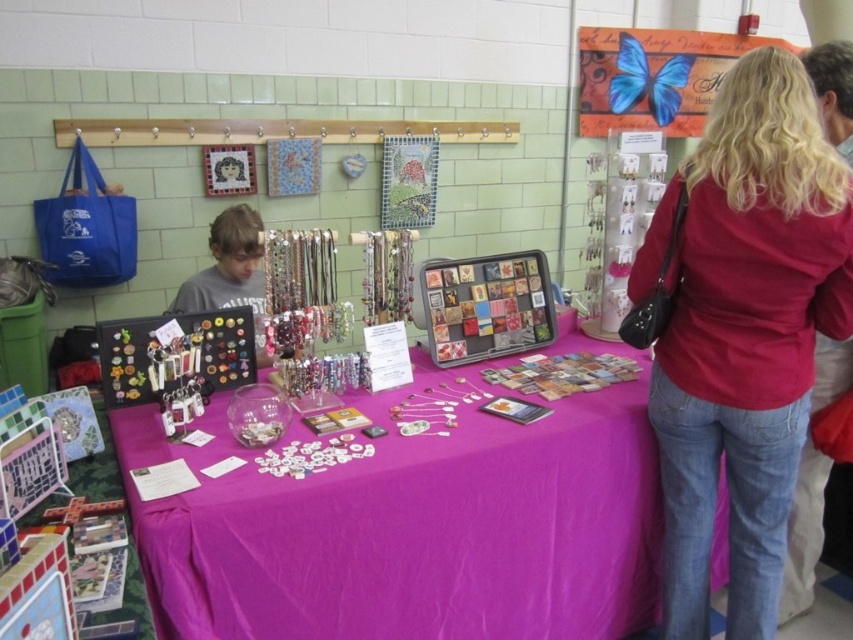
Question: Is purple fabric tablecloth at center to the right of matte red shirt at center from the viewer's perspective?

Choices:
 (A) no
 (B) yes

Answer: (A)

Question: Which is farther from the matte red shirt at center?

Choices:
 (A) matte blue butterfly at upper right
 (B) purple fabric tablecloth at center

Answer: (A)

Question: Is purple fabric tablecloth at center further to camera compared to matte blue butterfly at upper right?

Choices:
 (A) yes
 (B) no

Answer: (B)

Question: Which object is positioned farthest from the matte blue butterfly at upper right?

Choices:
 (A) matte red shirt at center
 (B) purple fabric tablecloth at center

Answer: (A)

Question: Which object is the farthest from the matte blue butterfly at upper right?

Choices:
 (A) purple fabric tablecloth at center
 (B) matte red shirt at center

Answer: (B)

Question: Does matte red shirt at center lie in front of matte blue butterfly at upper right?

Choices:
 (A) yes
 (B) no

Answer: (A)